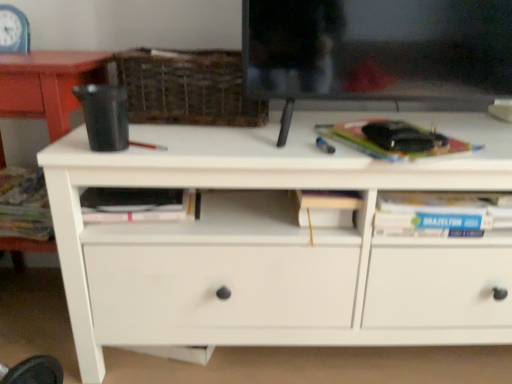
Locate an element on the screen. vacant region above pink matte paperback book at center, acting as the second paperback book starting from the right (from a real-world perspective) is located at coordinates (134, 195).